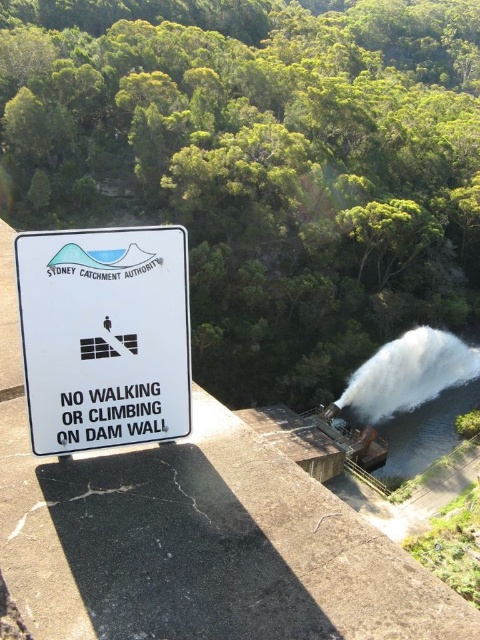
Question: Which of the following is the farthest from the observer?

Choices:
 (A) (467, 368)
 (B) (156, 381)

Answer: (A)

Question: Can you confirm if white plastic sign at center is positioned above white frothy water at center?

Choices:
 (A) no
 (B) yes

Answer: (B)

Question: Can you confirm if white plastic sign at center is positioned to the left of white frothy water at center?

Choices:
 (A) yes
 (B) no

Answer: (A)

Question: Does white plastic sign at center appear on the left side of white frothy water at center?

Choices:
 (A) yes
 (B) no

Answer: (A)

Question: Among these objects, which one is nearest to the camera?

Choices:
 (A) white frothy water at center
 (B) white plastic sign at center

Answer: (B)